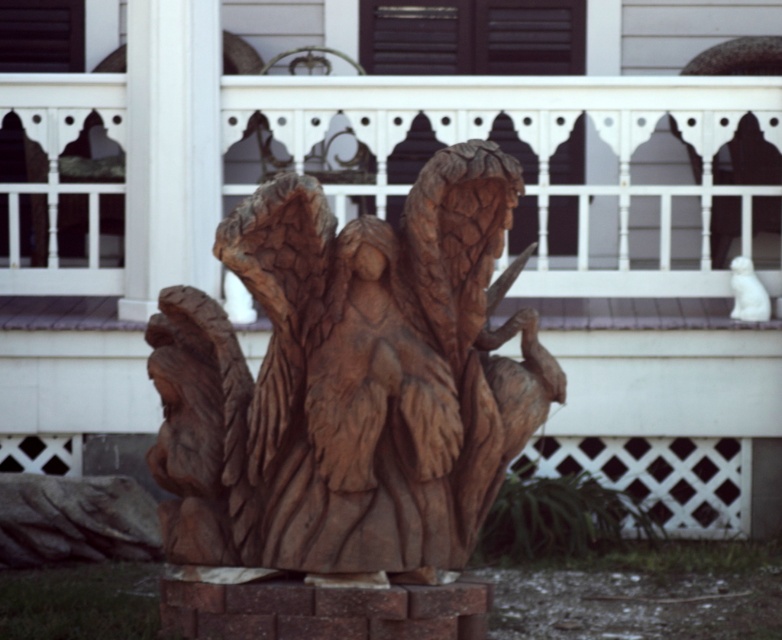
You are a painter standing at the edge of a garden. You need to paint both the white wood railing at center and the brown wood carving at center. Which object should you paint first if you want to start with the taller one?

The white wood railing at center is much taller than the brown wood carving at center, so you should paint the white wood railing at center first.

You are standing in a garden and see the white wood railing at center and the brown wood carving at center. Which object is located to the right of the other?

The white wood railing at center is positioned on the right side of brown wood carving at center.